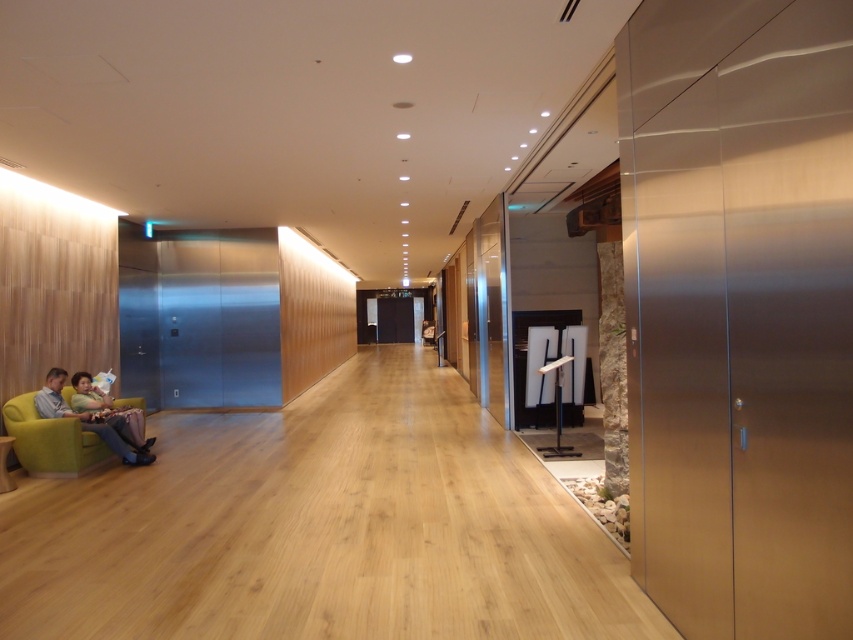
Is matte green fabric armchair at lower left below green fabric couch at lower left?

Yes.

Where is `matte green fabric armchair at lower left`? Image resolution: width=853 pixels, height=640 pixels. matte green fabric armchair at lower left is located at coordinates (51, 442).

Where is `matte green fabric armchair at lower left`? Image resolution: width=853 pixels, height=640 pixels. matte green fabric armchair at lower left is located at coordinates (51, 442).